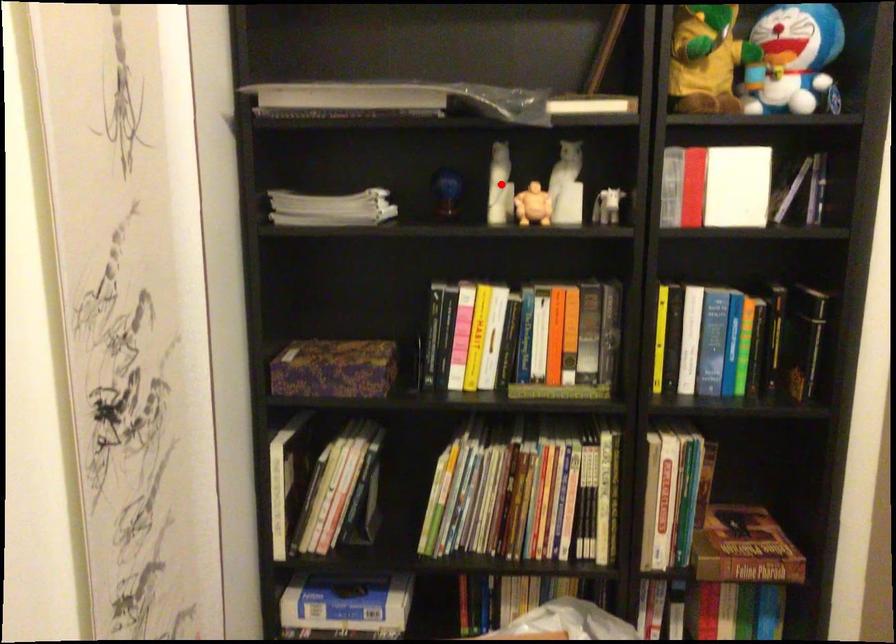
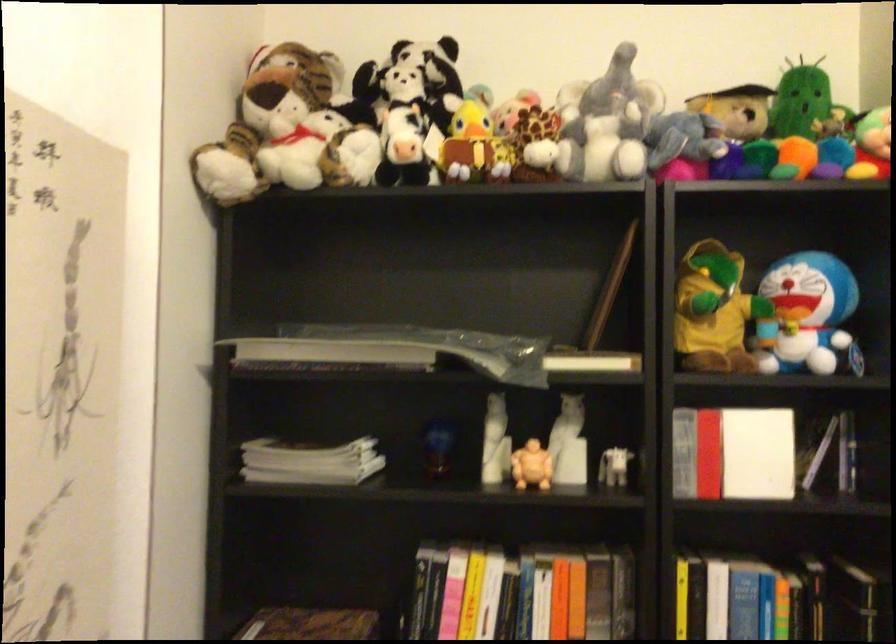
Find the pixel in the second image that matches the highlighted location in the first image.

(495, 442)